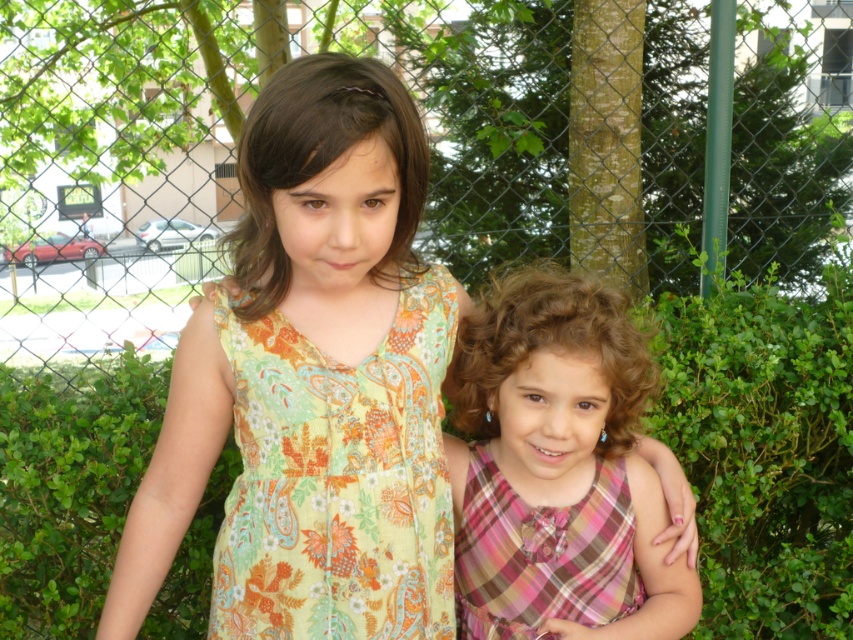
Consider the image. You are a photographer trying to capture both the pink plaid dress at center and the pink plaid dress at lower right in a single frame. Based on their positions, which dress will appear taller in the photo?

The pink plaid dress at center will appear taller in the photo because it has a greater height compared to the pink plaid dress at lower right.

You are a photographer standing 2 meters away from the girls. You want to take a photo of the point at coordinate point (479, 624). Can you reach the point without moving closer than 1.6 meters from your current position?

The distance of point (479, 624) from viewer is 1.61 meters, so you can reach the point without moving closer than 1.6 meters from your current position since 1.61 meters is just slightly beyond the 1.6 meters limit.